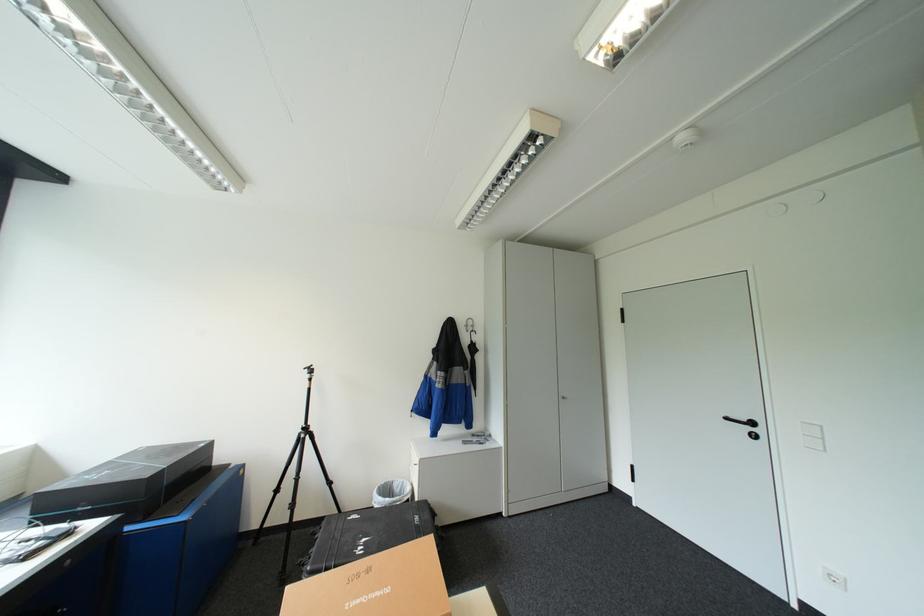
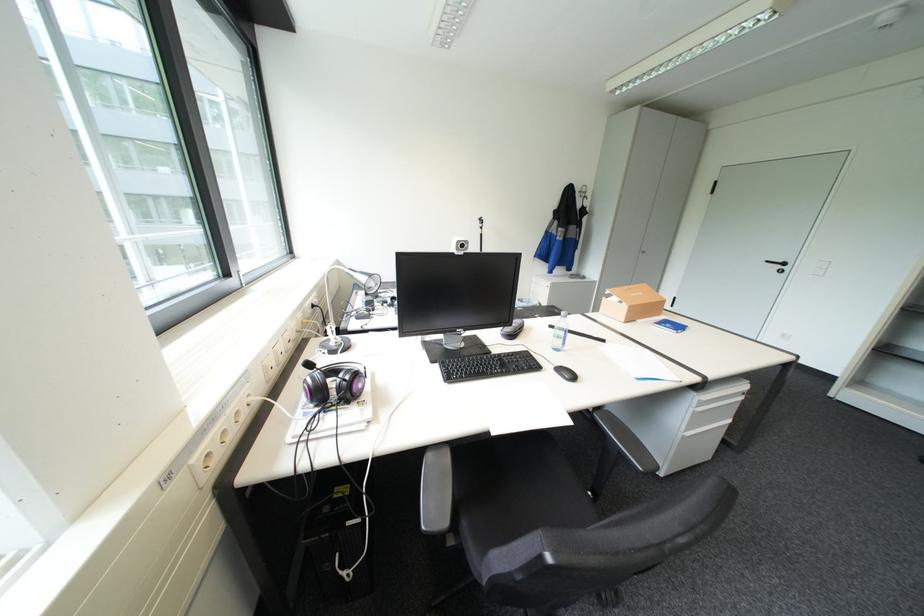
The images are taken continuously from a first-person perspective. In which direction are you moving?

The movement direction of the cameraman is left, backward.